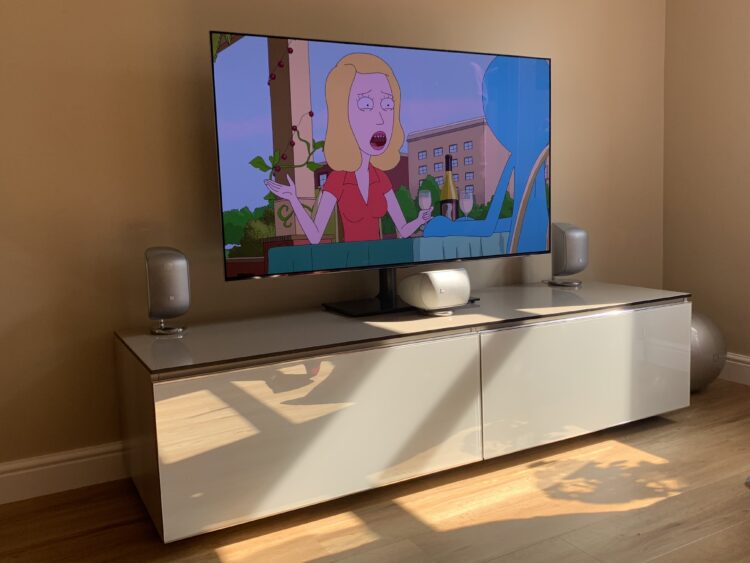
I want to click on corners of the television screen, so click(x=226, y=279), click(x=208, y=32), click(x=550, y=60), click(x=548, y=245).